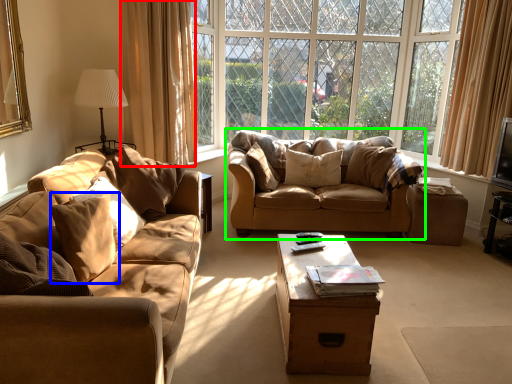
Question: Based on their relative distances, which object is nearer to curtain (highlighted by a red box)? Choose from pillow (highlighted by a blue box) and studio couch (highlighted by a green box).

Choices:
 (A) pillow
 (B) studio couch

Answer: (B)